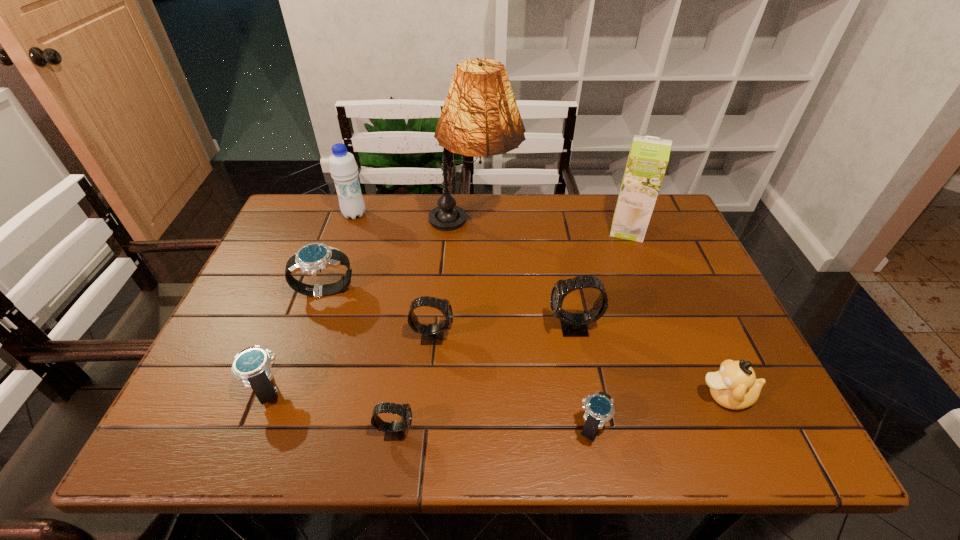
Locate an element on the screen. Image resolution: width=960 pixels, height=540 pixels. tan duckling is located at coordinates (734, 386).

Where is `the second biggest silver watch`? The width and height of the screenshot is (960, 540). the second biggest silver watch is located at coordinates (252, 365).

I want to click on the smallest gray watch, so click(394, 431).

I want to click on the smallest silver watch, so click(x=599, y=407).

Where is `the shortest object`? This screenshot has width=960, height=540. the shortest object is located at coordinates (599, 407).

Where is `blank space located 0.050m on the front-facing side of the lampshade`? Image resolution: width=960 pixels, height=540 pixels. blank space located 0.050m on the front-facing side of the lampshade is located at coordinates (537, 225).

Identify the location of vacant point located 0.360m on the front of the soya milk. (672, 345).

Find the location of a particular element. vacant space situated on the right of the blue water bottle is located at coordinates (479, 214).

Where is `free location located 0.280m on the face of the biggest gray watch`? The image size is (960, 540). free location located 0.280m on the face of the biggest gray watch is located at coordinates (427, 328).

Where is `vacant space located on the face of the biggest gray watch`? vacant space located on the face of the biggest gray watch is located at coordinates (384, 328).